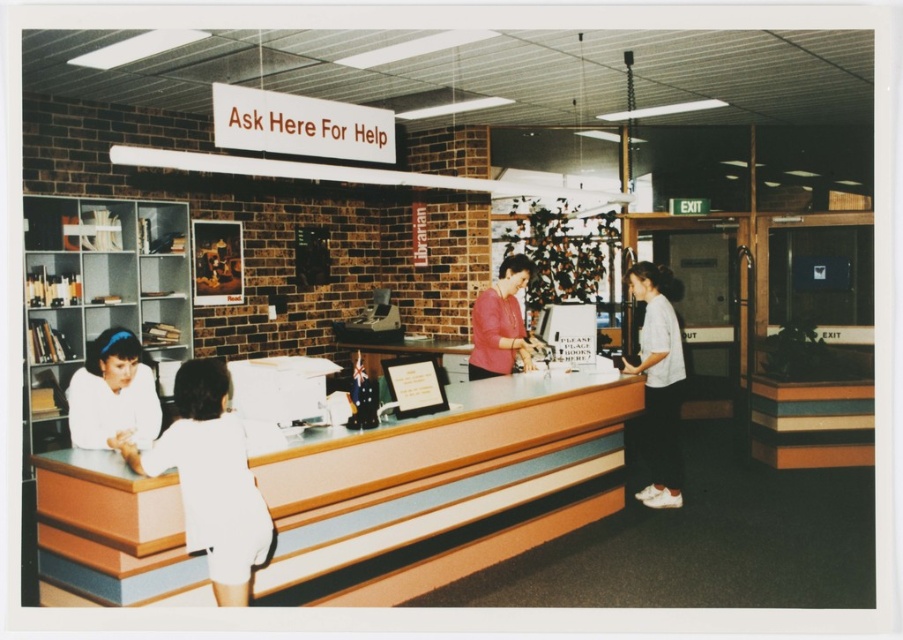
You are a visitor at the library and want to ask for help. You see the wooden counter at center and the white cotton shirt at right. Which object is taller?

The white cotton shirt at right is taller than the wooden counter at center.

You are a visitor at the library and want to approach the wooden counter at center to ask for help. There is a staff member in a white cotton shirt at right nearby. Which object should you walk towards first?

You should walk towards the wooden counter at center first because it is closer to you than the white cotton shirt at right, which is further away.